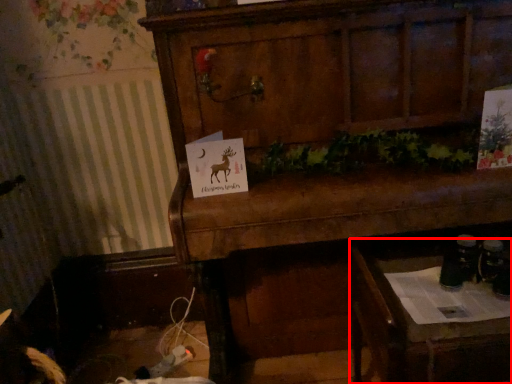
Question: Observing the image, what is the correct spatial positioning of table (annotated by the red box) in reference to furniture?

Choices:
 (A) right
 (B) left

Answer: (A)